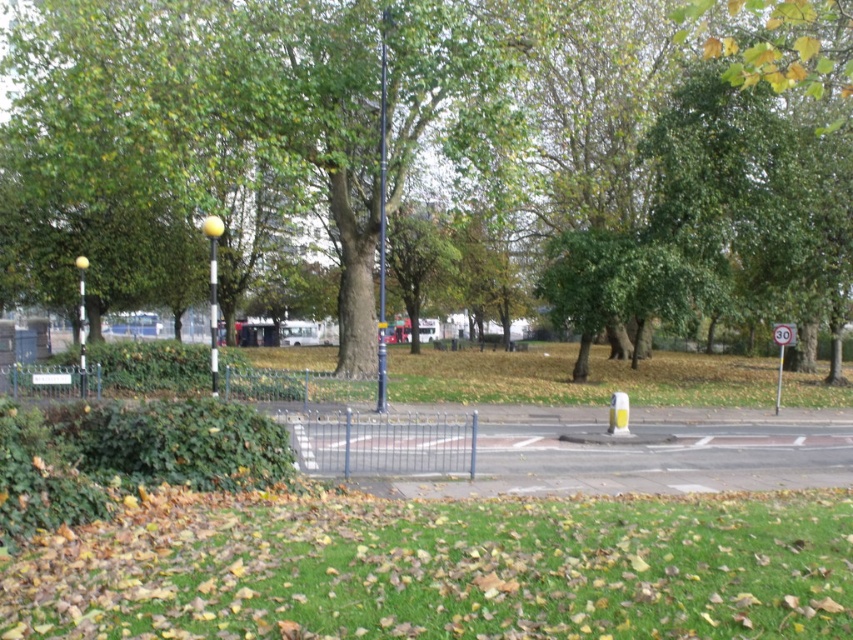
Question: Does green leafy tree at center have a smaller size compared to green grass at lower center?

Choices:
 (A) no
 (B) yes

Answer: (A)

Question: Which object is closer to the camera taking this photo?

Choices:
 (A) green grass at lower center
 (B) green leafy tree at center

Answer: (A)

Question: Which object is farther from the camera taking this photo?

Choices:
 (A) green leafy tree at center
 (B) green grass at lower center

Answer: (A)

Question: Can you confirm if green leafy tree at center is wider than green grass at lower center?

Choices:
 (A) yes
 (B) no

Answer: (A)

Question: Is green leafy tree at center to the left of green grass at lower center from the viewer's perspective?

Choices:
 (A) yes
 (B) no

Answer: (A)